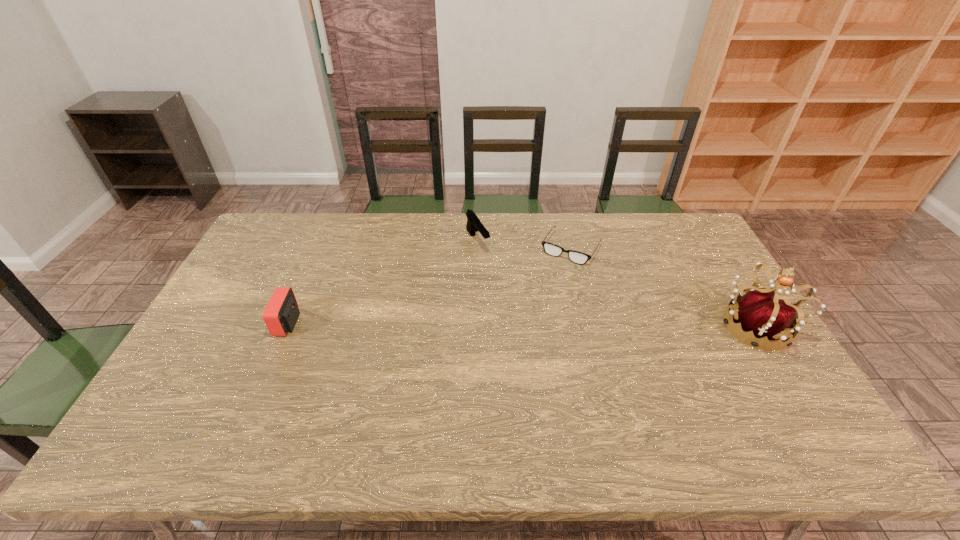
This screenshot has height=540, width=960. In the image, there is a desktop. Find the location of `vacant space at the left edge`. vacant space at the left edge is located at coordinates (204, 330).

Locate an element on the screen. vacant space at the right edge of the desktop is located at coordinates (723, 348).

You are a GUI agent. You are given a task and a screenshot of the screen. Output one action in this format:
    pyautogui.click(x=<x>, y=<y>)
    Task: Click on the vacant space at the near left corner
    The width and height of the screenshot is (960, 540).
    Given the screenshot: What is the action you would take?
    tap(166, 395)

Identify the location of blank space at the far right corner. This screenshot has height=540, width=960. (657, 232).

In the image, there is a desktop. Identify the location of vacant space at the near right corner. The height and width of the screenshot is (540, 960). [x=769, y=405].

Find the location of a particular element. vacant area that lies between the shortest object and the alarm clock is located at coordinates (429, 286).

Locate an element on the screen. The image size is (960, 540). free space between the second object from left to right and the leftmost object is located at coordinates (382, 282).

Locate an element on the screen. vacant region between the tallest object and the alarm clock is located at coordinates (521, 325).

I want to click on free spot between the alarm clock and the tallest object, so click(521, 325).

Find the location of a particular element. The image size is (960, 540). free space between the rightmost object and the second object from right to left is located at coordinates (662, 288).